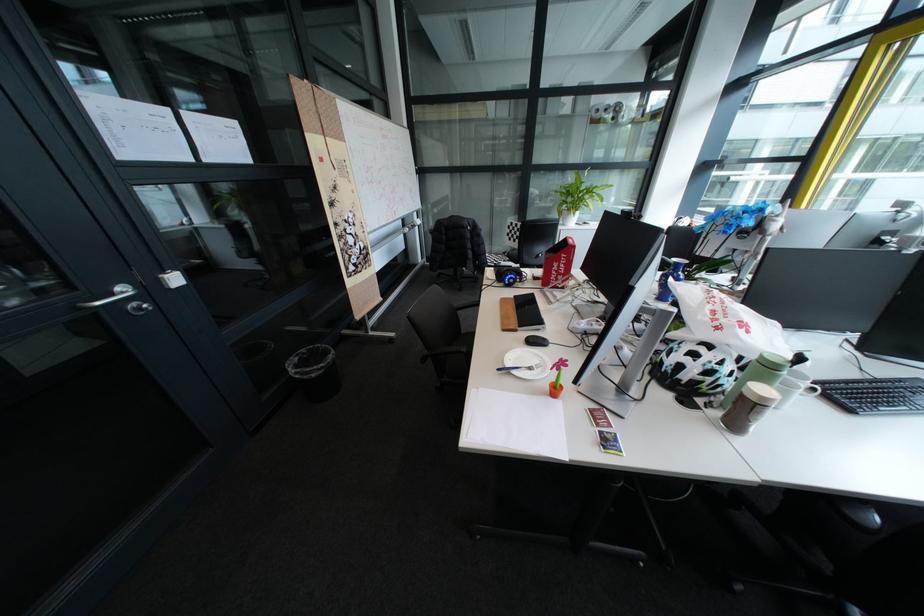
I want to click on brown shaker jar, so click(x=748, y=408).